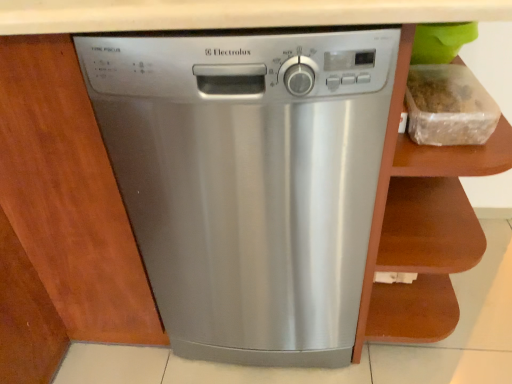
Question: From the image's perspective, would you say clear plastic container at upper right is shown under stainless steel dishwasher at center?

Choices:
 (A) yes
 (B) no

Answer: (B)

Question: Can you confirm if clear plastic container at upper right is positioned to the left of stainless steel dishwasher at center?

Choices:
 (A) no
 (B) yes

Answer: (A)

Question: Is clear plastic container at upper right wider than stainless steel dishwasher at center?

Choices:
 (A) yes
 (B) no

Answer: (B)

Question: Is clear plastic container at upper right not within stainless steel dishwasher at center?

Choices:
 (A) no
 (B) yes

Answer: (B)

Question: From a real-world perspective, is clear plastic container at upper right physically below stainless steel dishwasher at center?

Choices:
 (A) no
 (B) yes

Answer: (A)

Question: From the image's perspective, is clear plastic container at upper right above or below brown wood cabinet at right?

Choices:
 (A) above
 (B) below

Answer: (A)

Question: Visually, is clear plastic container at upper right positioned to the left or to the right of brown wood cabinet at right?

Choices:
 (A) right
 (B) left

Answer: (B)

Question: Looking at their shapes, would you say clear plastic container at upper right is wider or thinner than brown wood cabinet at right?

Choices:
 (A) wide
 (B) thin

Answer: (B)

Question: In terms of height, does clear plastic container at upper right look taller or shorter compared to brown wood cabinet at right?

Choices:
 (A) short
 (B) tall

Answer: (A)

Question: Considering the relative positions of brown wood cabinet at right and clear plastic container at upper right in the image provided, is brown wood cabinet at right to the left or to the right of clear plastic container at upper right?

Choices:
 (A) right
 (B) left

Answer: (A)

Question: From the image's perspective, is brown wood cabinet at right positioned above or below clear plastic container at upper right?

Choices:
 (A) below
 (B) above

Answer: (A)

Question: Considering their positions, is brown wood cabinet at right located in front of or behind clear plastic container at upper right?

Choices:
 (A) front
 (B) behind

Answer: (A)

Question: Do you think brown wood cabinet at right is within clear plastic container at upper right, or outside of it?

Choices:
 (A) inside
 (B) outside

Answer: (B)

Question: From the image's perspective, relative to clear plastic container at upper right, is stainless steel dishwasher at center above or below?

Choices:
 (A) above
 (B) below

Answer: (B)

Question: Considering the positions of point (295, 79) and point (458, 66), is point (295, 79) closer or farther from the camera than point (458, 66)?

Choices:
 (A) closer
 (B) farther

Answer: (A)